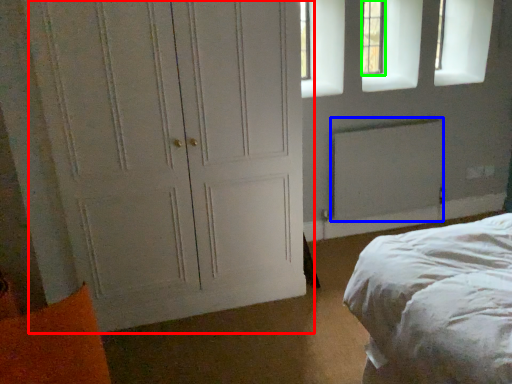
Question: Based on their relative distances, which object is nearer to door (highlighted by a red box)? Choose from radiator (highlighted by a blue box) and window (highlighted by a green box).

Choices:
 (A) radiator
 (B) window

Answer: (A)